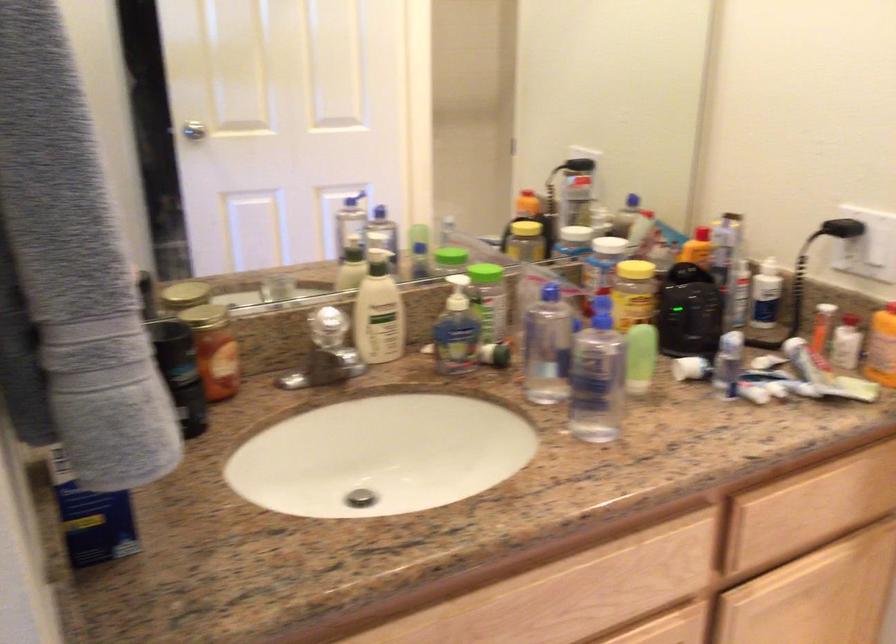
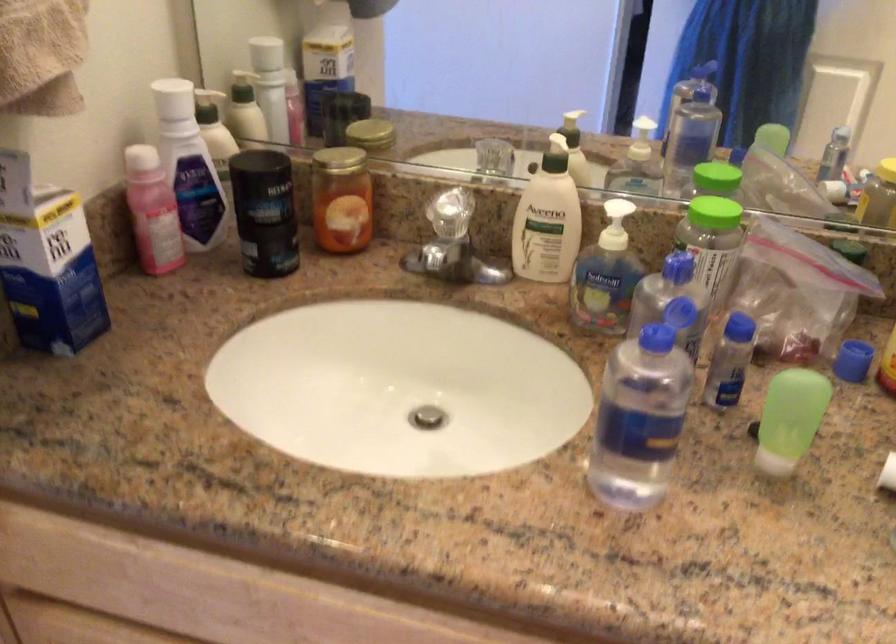
In the second image, find the point that corresponds to (650,352) in the first image.

(789, 419)